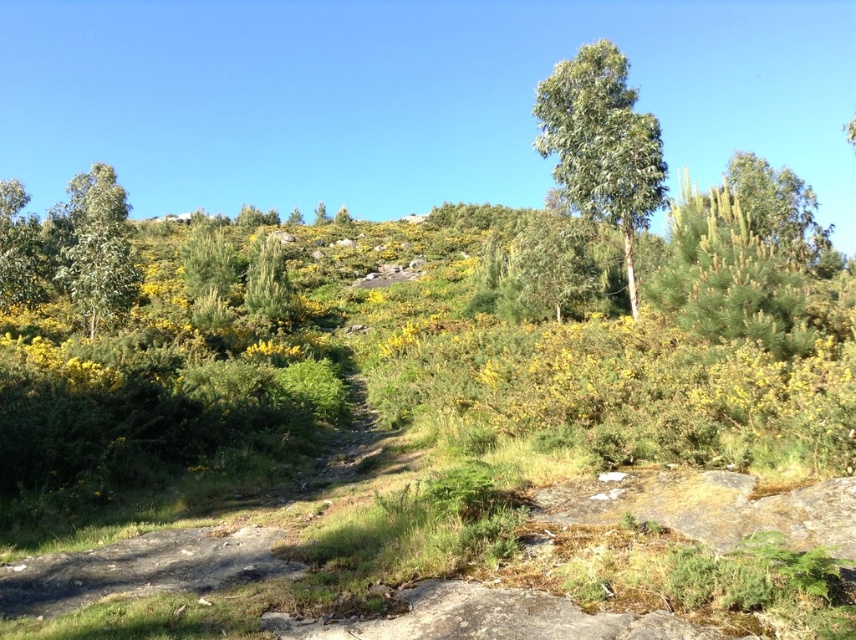
You are a hiker trying to navigate through the landscape. You see the green leafy tree at upper center and the green matte tree at upper left. Which tree is shorter?

The green leafy tree at upper center is shorter than the green matte tree at upper left.

You are a hiker trying to navigate through the landscape shown in the image. You need to pass between the green leafy tree at upper center and the green matte tree at upper left. Which tree will you have to maneuver closer to in order to pass through the narrower space?

The green leafy tree at upper center has a lesser width compared to the green matte tree at upper left, so you will have to maneuver closer to the green leafy tree at upper center to pass through the narrower space.

You are a hiker carrying a heavy backpack and want to take a photo of the green grassy trail at center. You need to stand exactly 4.45 meters away from it to get the perfect shot. Can you position yourself correctly along the narrow dirt path winding through the area?

The green grassy trail at center and camera are 4.45 meters apart from each other, so yes, you can position yourself correctly along the narrow dirt path winding through the area to be exactly 4.45 meters away from the green grassy trail at center.